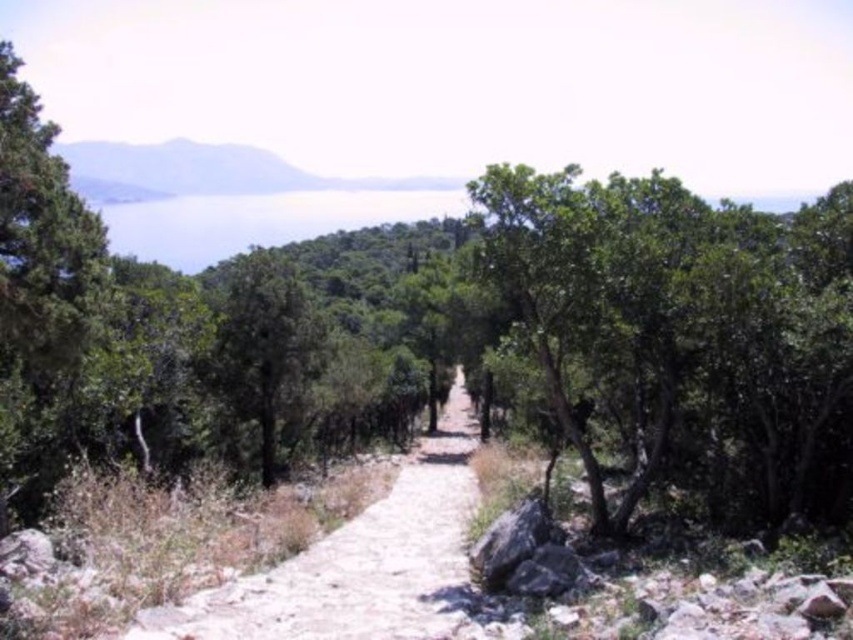
You are standing at the starting point of the dirt path in the forest. You want to reach the large rock formation near the bottom right corner of the path. Which direction should you walk relative to the green leafy tree at center?

The green leafy tree at center is located at point (683, 333). Since the large rock formation is near the bottom right corner, you should walk towards the bottom right direction away from the green leafy tree at center to reach it.

Looking at this image, you are a hiker walking along the dusty stone path at center and want to take a photo of the green leafy tree at center. Since the tree is above the path, where should you position yourself relative to the path to frame the tree properly in your camera?

The green leafy tree at center is positioned over the dusty stone path at center, so you should stand on the side of the path opposite the tree to frame it properly in your camera.